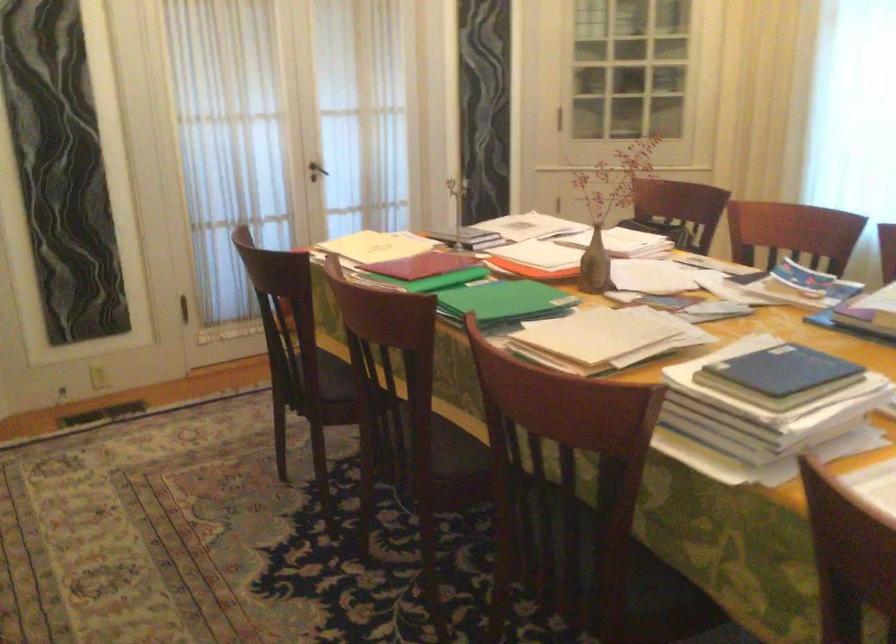
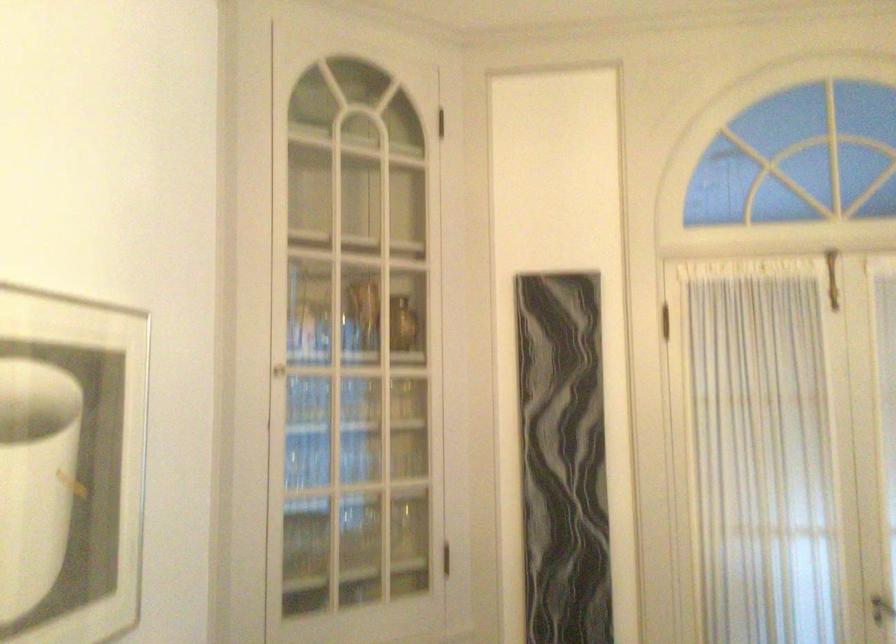
Find the pixel in the second image that matches (315,175) in the first image.

(882, 609)